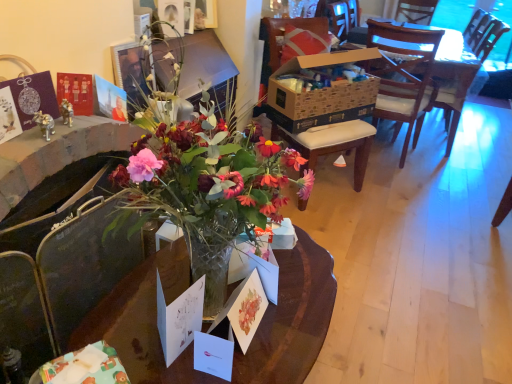
The width and height of the screenshot is (512, 384). Find the location of `free space in front of wooden armchair at center`. free space in front of wooden armchair at center is located at coordinates (444, 162).